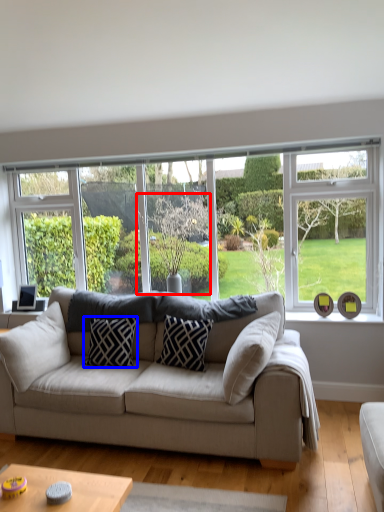
Question: Among these objects, which one is nearest to the camera, tree (highlighted by a red box) or pillow (highlighted by a blue box)?

Choices:
 (A) tree
 (B) pillow

Answer: (B)